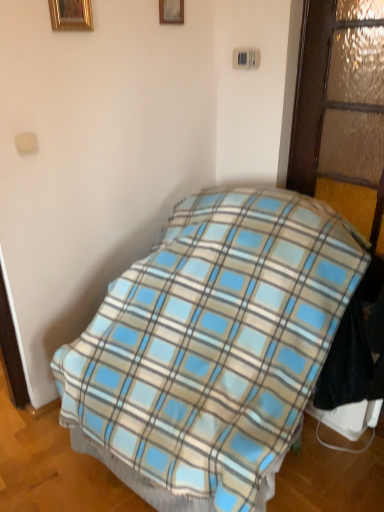
Question: Is wooden picture frame at upper center, placed as the first picture frame when sorted from right to left, taller than blue plaid blanket at center?

Choices:
 (A) no
 (B) yes

Answer: (A)

Question: Are wooden picture frame at upper center, the 2th picture frame when ordered from front to back, and blue plaid blanket at center making contact?

Choices:
 (A) yes
 (B) no

Answer: (B)

Question: From a real-world perspective, is wooden picture frame at upper center, placed as the first picture frame when sorted from right to left, below blue plaid blanket at center?

Choices:
 (A) yes
 (B) no

Answer: (B)

Question: Would you consider wooden picture frame at upper center, the 2th picture frame when ordered from front to back, to be distant from blue plaid blanket at center?

Choices:
 (A) yes
 (B) no

Answer: (A)

Question: Is blue plaid blanket at center located within wooden picture frame at upper center, arranged as the 2th picture frame when viewed from the left?

Choices:
 (A) no
 (B) yes

Answer: (A)

Question: Do you think wooden picture frame at upper center, the 2th picture frame when ordered from front to back, is within gold metallic picture frame at upper left, which is the second picture frame in back-to-front order, or outside of it?

Choices:
 (A) inside
 (B) outside

Answer: (B)

Question: In terms of height, does wooden picture frame at upper center, arranged as the 2th picture frame when viewed from the left, look taller or shorter compared to gold metallic picture frame at upper left, the second picture frame in the right-to-left sequence?

Choices:
 (A) short
 (B) tall

Answer: (A)

Question: Considering the positions of point tap(162, 7) and point tap(84, 11), is point tap(162, 7) closer or farther from the camera than point tap(84, 11)?

Choices:
 (A) closer
 (B) farther

Answer: (B)

Question: From a real-world perspective, is wooden picture frame at upper center, the 2th picture frame when ordered from front to back, physically located above or below gold metallic picture frame at upper left, acting as the 1th picture frame starting from the front?

Choices:
 (A) above
 (B) below

Answer: (A)

Question: In terms of width, does blue plaid blanket at center look wider or thinner when compared to textured frosted glass door at right?

Choices:
 (A) thin
 (B) wide

Answer: (B)

Question: Based on their sizes in the image, would you say blue plaid blanket at center is bigger or smaller than textured frosted glass door at right?

Choices:
 (A) small
 (B) big

Answer: (B)

Question: Is point (299, 336) closer or farther from the camera than point (334, 203)?

Choices:
 (A) farther
 (B) closer

Answer: (B)

Question: Is blue plaid blanket at center taller or shorter than textured frosted glass door at right?

Choices:
 (A) tall
 (B) short

Answer: (A)

Question: Considering the positions of point (59, 15) and point (370, 1), is point (59, 15) closer or farther from the camera than point (370, 1)?

Choices:
 (A) closer
 (B) farther

Answer: (A)

Question: Considering the positions of gold metallic picture frame at upper left, the second picture frame in the right-to-left sequence, and textured frosted glass door at right in the image, is gold metallic picture frame at upper left, the second picture frame in the right-to-left sequence, bigger or smaller than textured frosted glass door at right?

Choices:
 (A) big
 (B) small

Answer: (B)